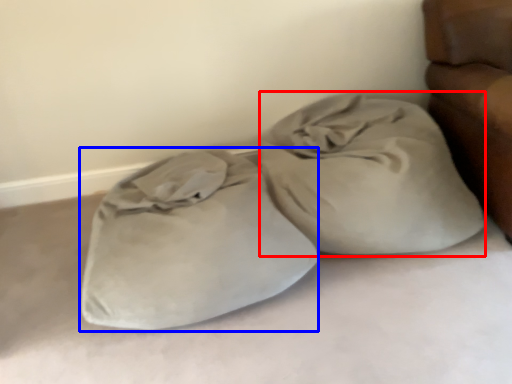
Question: Among these objects, which one is farthest to the camera, sack (highlighted by a red box) or sleeping bag (highlighted by a blue box)?

Choices:
 (A) sack
 (B) sleeping bag

Answer: (A)